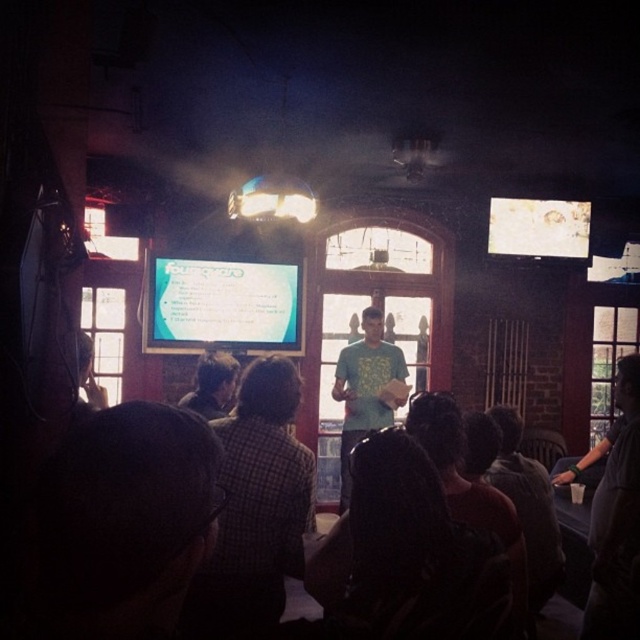
Between point (232, 618) and point (372, 374), which one is positioned behind?

The point (372, 374) is behind.

Who is positioned more to the right, checkered fabric shirt at lower left or green matte shirt at center?

green matte shirt at center is more to the right.

Measure the distance between checkered fabric shirt at lower left and camera.

checkered fabric shirt at lower left is 2.30 meters away from camera.

Locate an element on the screen. checkered fabric shirt at lower left is located at coordinates (257, 504).

Is green matte shirt at center positioned before plaid shirt at center?

No, green matte shirt at center is further to the viewer.

Identify the location of green matte shirt at center. (365, 388).

Does point (225, 632) lie in front of point (221, 362)?

Yes, it is.

Can you confirm if checkered fabric shirt at lower left is smaller than plaid shirt at center?

No, checkered fabric shirt at lower left is not smaller than plaid shirt at center.

Describe the element at coordinates (257, 504) in the screenshot. I see `checkered fabric shirt at lower left` at that location.

At what (x,y) coordinates should I click in order to perform the action: click on checkered fabric shirt at lower left. Please return your answer as a coordinate pair (x, y). The image size is (640, 640). Looking at the image, I should click on (257, 504).